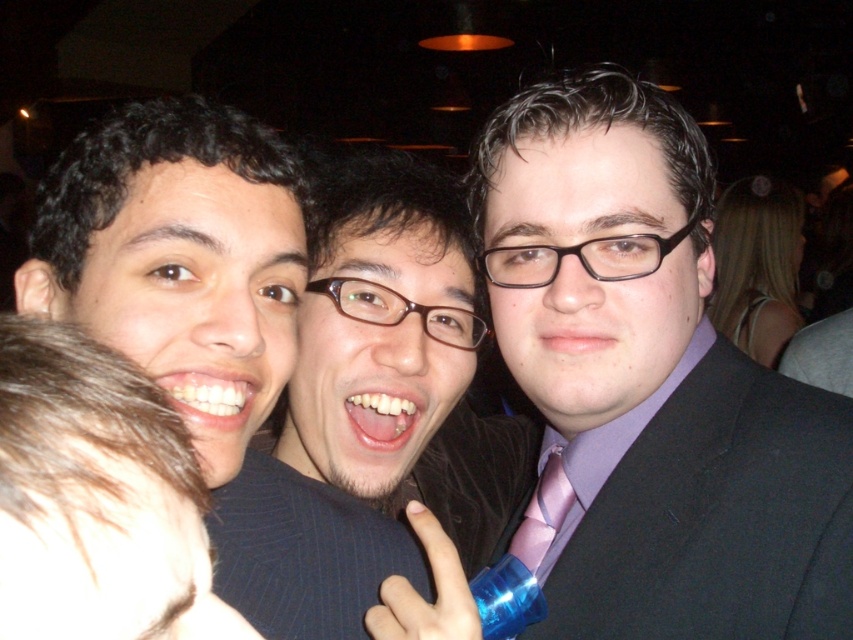
Can you confirm if dark gray suit at right is thinner than matte black hair at left?

In fact, dark gray suit at right might be wider than matte black hair at left.

This screenshot has height=640, width=853. What do you see at coordinates (706, 509) in the screenshot? I see `dark gray suit at right` at bounding box center [706, 509].

At what (x,y) coordinates should I click in order to perform the action: click on dark gray suit at right. Please return your answer as a coordinate pair (x, y). Image resolution: width=853 pixels, height=640 pixels. Looking at the image, I should click on (706, 509).

Is point (399, 225) less distant than point (820, 560)?

That is False.

Where is `brown pinstriped suit at center`? brown pinstriped suit at center is located at coordinates (386, 390).

Which is below, brown pinstriped suit at center or matte black hair at left?

brown pinstriped suit at center

Is brown pinstriped suit at center shorter than matte black hair at left?

Incorrect, brown pinstriped suit at center's height does not fall short of matte black hair at left's.

Is point (358, 344) positioned before point (271, 221)?

No, it is behind (271, 221).

You are a GUI agent. You are given a task and a screenshot of the screen. Output one action in this format:
    pyautogui.click(x=<x>, y=<y>)
    Task: Click on the brown pinstriped suit at center
    The width and height of the screenshot is (853, 640).
    Given the screenshot: What is the action you would take?
    click(386, 390)